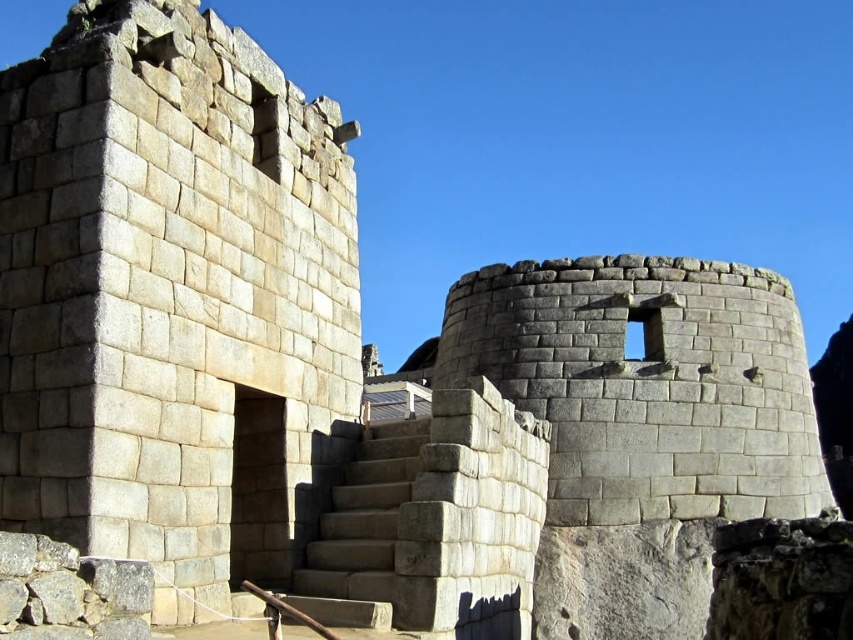
Who is lower down, gray stone wall at center or gray stone stairs at center?

Positioned lower is gray stone stairs at center.

Can you confirm if gray stone wall at center is bigger than gray stone stairs at center?

Yes.

Is point (100, 104) less distant than point (334, 516)?

Yes, it is.

The height and width of the screenshot is (640, 853). I want to click on gray stone wall at center, so click(173, 296).